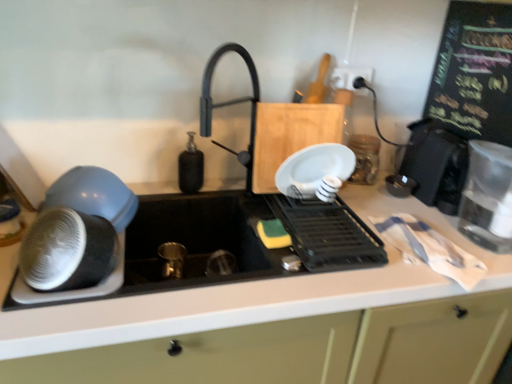
Identify the location of unoccupied area in front of clear glass jar at upper right, placed as the second appliance when sorted from right to left. Image resolution: width=512 pixels, height=384 pixels. (385, 203).